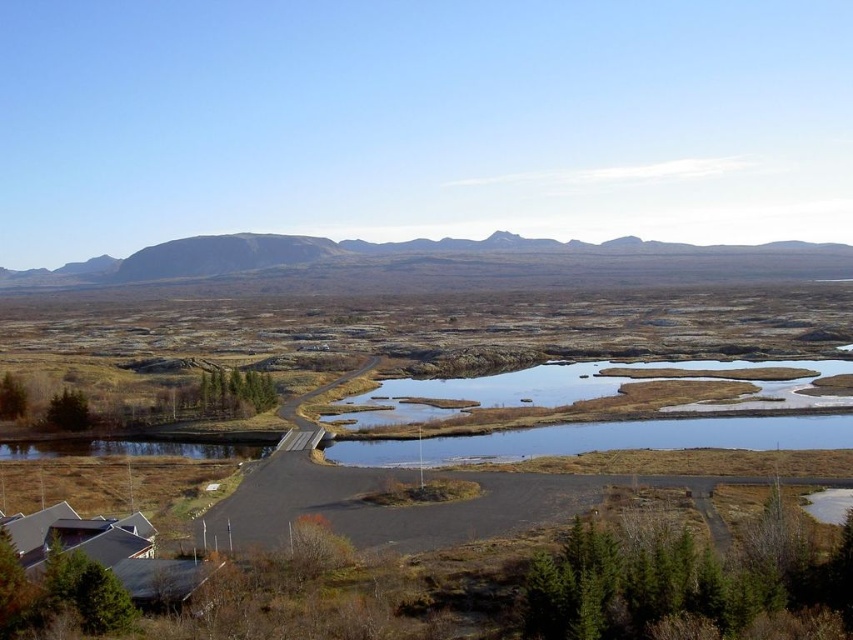
Who is higher up, brown grassy lake at center or gray rocky mountain at center?

gray rocky mountain at center is above.

Which of these two, brown grassy lake at center or gray rocky mountain at center, stands shorter?

Standing shorter between the two is brown grassy lake at center.

Is point (403, 454) farther from camera compared to point (219, 241)?

No, it is not.

Locate an element on the screen. Image resolution: width=853 pixels, height=640 pixels. brown grassy lake at center is located at coordinates (646, 436).